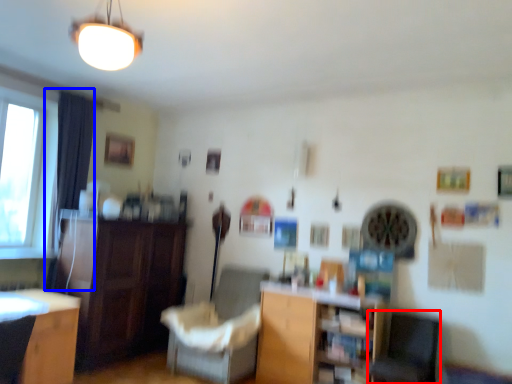
Question: Which of the following is the closest to the observer, swivel chair (highlighted by a red box) or curtain (highlighted by a blue box)?

Choices:
 (A) swivel chair
 (B) curtain

Answer: (A)